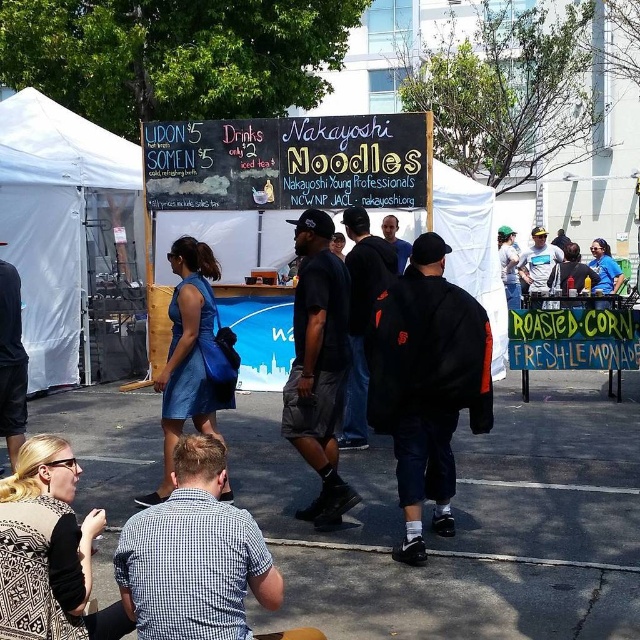
You are standing at the entrance of the food market and see the blue denim dress at center. If you walk straight ahead, will you pass by the food stall with the blackboard sign?

The blue denim dress at center is located at point (x=189, y=356), which is in the central area of the image. Since the food stall with the blackboard sign is the central focus, walking straight ahead from the entrance would lead you toward the stall, so yes, you will pass by the food stall with the blackboard sign.

From the picture: You are a photographer at the market and want to capture both the blue denim dress at center and the blue jersey at right in a single photo. Which clothing item will appear larger in the photo?

The blue denim dress at center will appear larger in the photo because it is much taller than the blue jersey at right.

You are standing at the food stall and want to greet the person wearing the blue denim dress at center and the person wearing the blue jersey at right. Which one is closer to you?

The blue denim dress at center is closer to you since it is only 9.28 meters away from the blue jersey at right, but since you are at the stall, the blue denim dress at center is closer than the blue jersey at right.